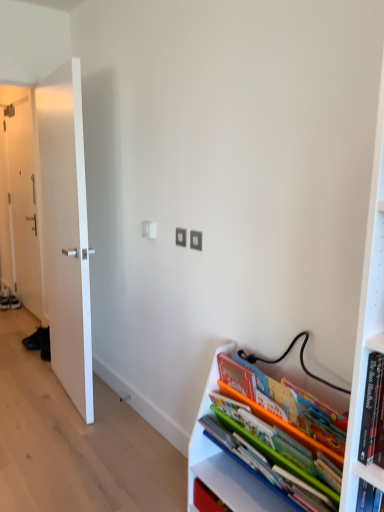
Question: Would you say white smooth door at left, the 1th door when ordered from front to back, is to the left or to the right of matte plastic books at lower right in the picture?

Choices:
 (A) right
 (B) left

Answer: (B)

Question: From their relative heights in the image, would you say white smooth door at left, marked as the 1th door in a right-to-left arrangement, is taller or shorter than matte plastic books at lower right?

Choices:
 (A) tall
 (B) short

Answer: (A)

Question: Based on their relative distances, which object is nearer to the white smooth door at left, marked as the 1th door in a right-to-left arrangement?

Choices:
 (A) white matte door at left, acting as the first door starting from the left
 (B) matte plastic books at lower right

Answer: (B)

Question: Estimate the real-world distances between objects in this image. Which object is closer to the white matte door at left, acting as the first door starting from the left?

Choices:
 (A) white smooth door at left, the 1th door when ordered from front to back
 (B) matte plastic books at lower right

Answer: (A)